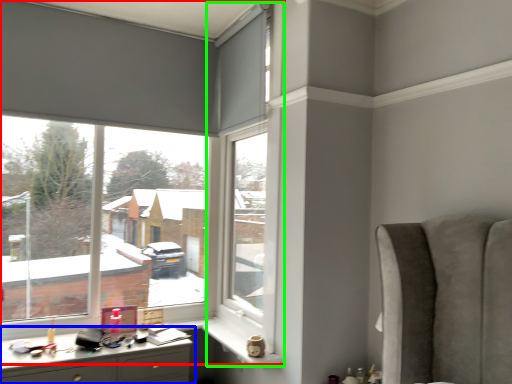
Question: Which is farther away from window (highlighted by a red box)? desk (highlighted by a blue box) or window frame (highlighted by a green box)?

Choices:
 (A) desk
 (B) window frame

Answer: (A)